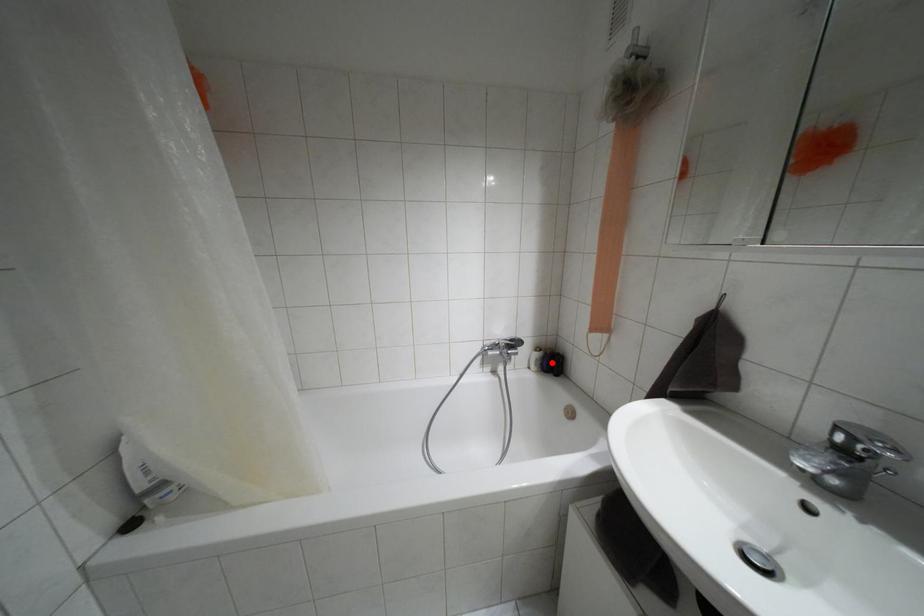
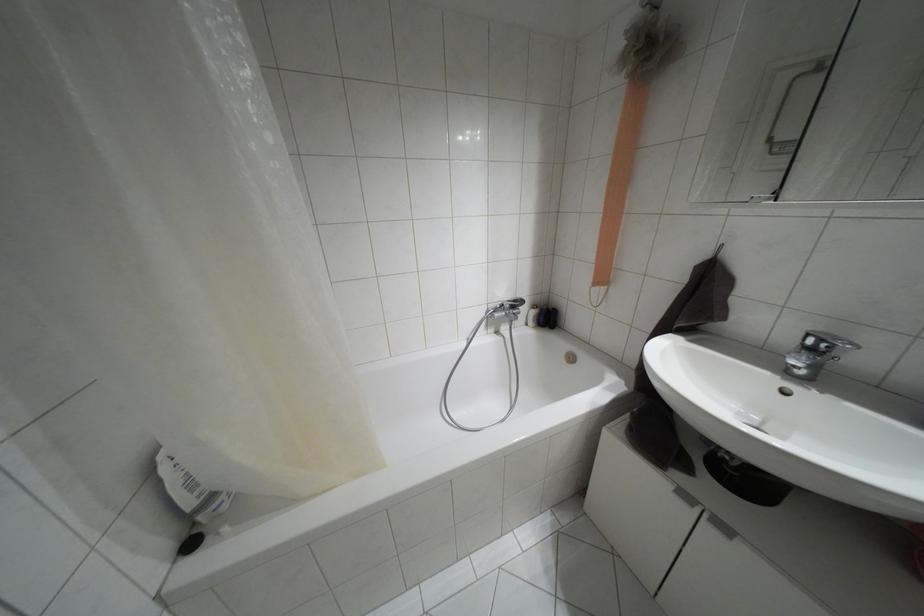
Find the pixel in the second image that matches the highlighted location in the first image.

(546, 317)